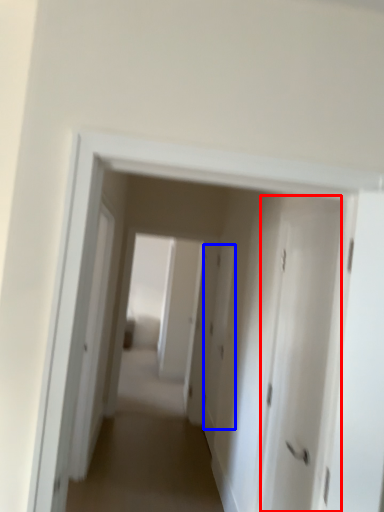
Question: Which object appears closest to the camera in this image, door (highlighted by a red box) or door (highlighted by a blue box)?

Choices:
 (A) door
 (B) door

Answer: (A)